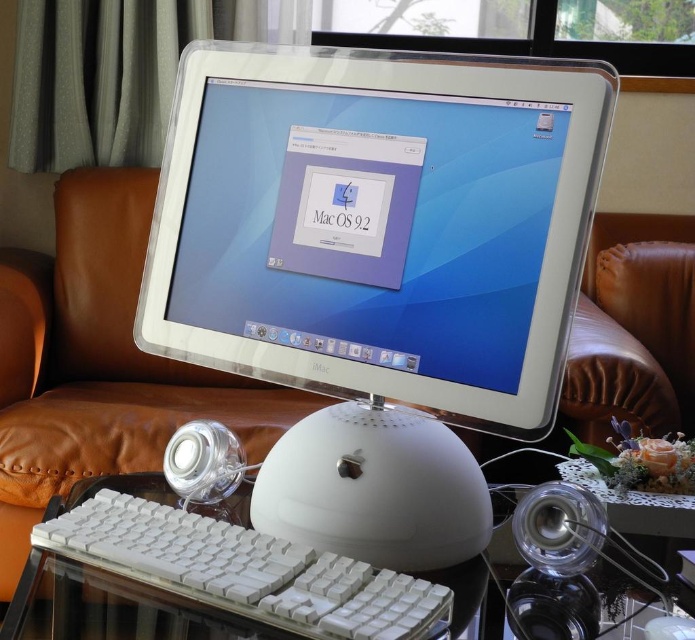
You have a new mouse and keyboard to place on the desk. The current setup has the white plastic mouse at center and the white plastic keyboard at center. If the new mouse is the same size as the existing one, will it fit in the space between them?

The white plastic mouse at center is narrower than the white plastic keyboard at center, so placing another mouse of the same size next to it should fit within the available space between them.

From the picture: You are standing in the living room and want to place a new lamp on the desk where the white plastic imac at center is located. The lamp requires a space of 10 cm in diameter. Can you determine if there is enough space next to the white plastic imac at center based on its position at point (377,269)?

The white plastic imac at center is located at point (377,269). However, without knowing the dimensions of the desk or the available space around the imac, it is impossible to determine if there is enough space for the lamp.

You are setting up a desk for a child who needs to use a computer. You have the white plastic mouse at center and the white plastic keyboard at center. Which object should you place closer to the edge of the desk to ensure the child can easily reach it without stretching?

The white plastic mouse at center is smaller than the white plastic keyboard at center, so placing the mouse closer to the edge of the desk would allow the child to reach it more easily while keeping the larger keyboard in a central position for typing.